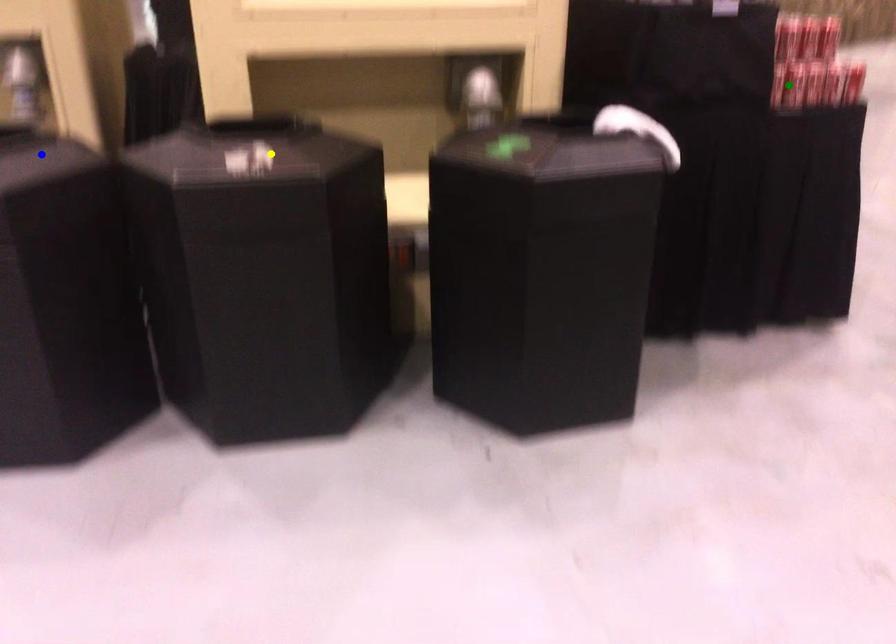
Order these from nearest to farthest:
blue point
green point
yellow point

yellow point
green point
blue point